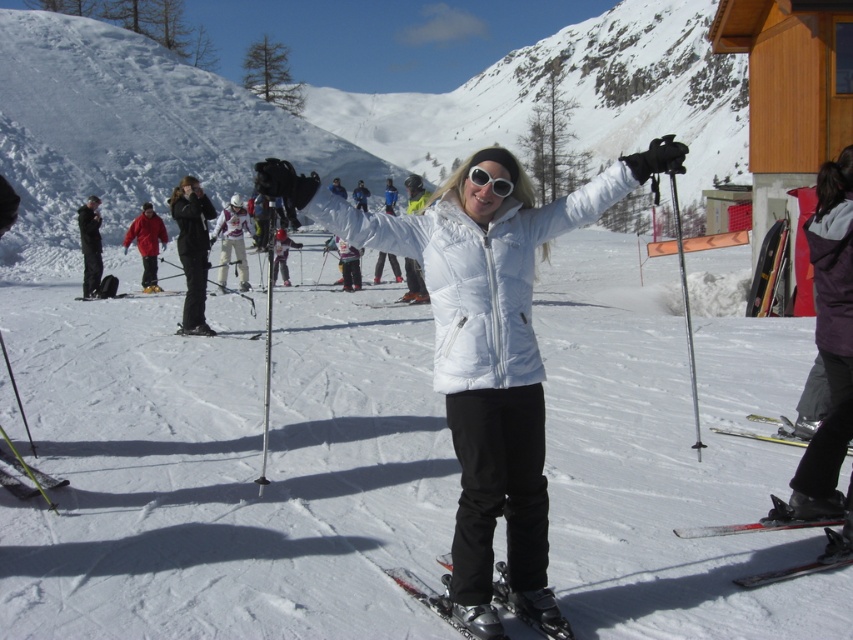
You are a ski instructor preparing to teach a beginner how to position their skis correctly. The beginner has the yellow metallic ski at lower right and the black matte ski at lower left. Based on the scene, can the beginner place both skis parallel to each other without overlapping?

The yellow metallic ski at lower right and black matte ski at lower left are 47.64 feet apart. Since the distance between them is significant, the beginner can place both skis parallel to each other without overlapping as there is enough space between them.

You are a photographer trying to capture the perfect shot of the skier. You notice the black matte ski at center and the white plastic ski at center. Which ski should you focus on first if you want to capture the one closer to the ground?

The black matte ski at center is located below the white plastic ski at center, so you should focus on the black matte ski at center first as it is closer to the ground.